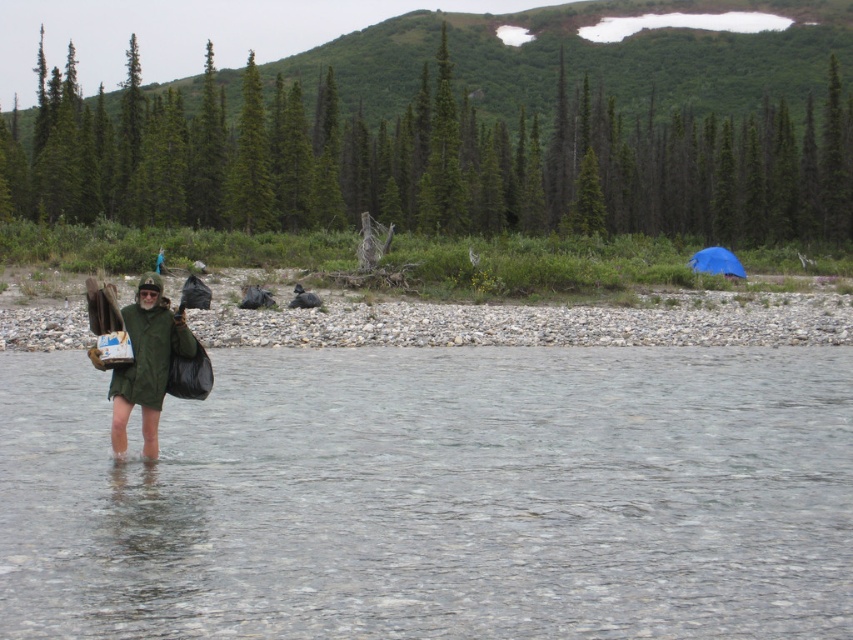
You are a hiker who wants to cross the river safely. You see the clear water at center and the green matte jacket at center. Which object is closer to you as you approach the river?

The clear water at center is in front of the green matte jacket at center, so the clear water at center is closer to you as you approach the river.

You are planning to cross the river using the clear water at center and the blue tarp at right. Which area should you choose to ensure a safer crossing, and why?

You should choose the clear water at center because it is larger in size than the blue tarp at right, making it more stable and safer for crossing.